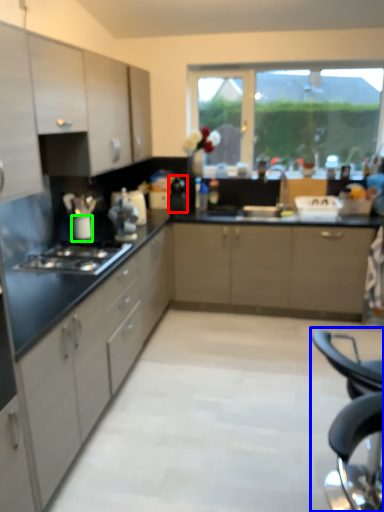
Question: Estimate the real-world distances between objects in this image. Which object is farther from appliance (highlighted by a red box), folding chair (highlighted by a blue box) or appliance (highlighted by a green box)?

Choices:
 (A) folding chair
 (B) appliance

Answer: (A)